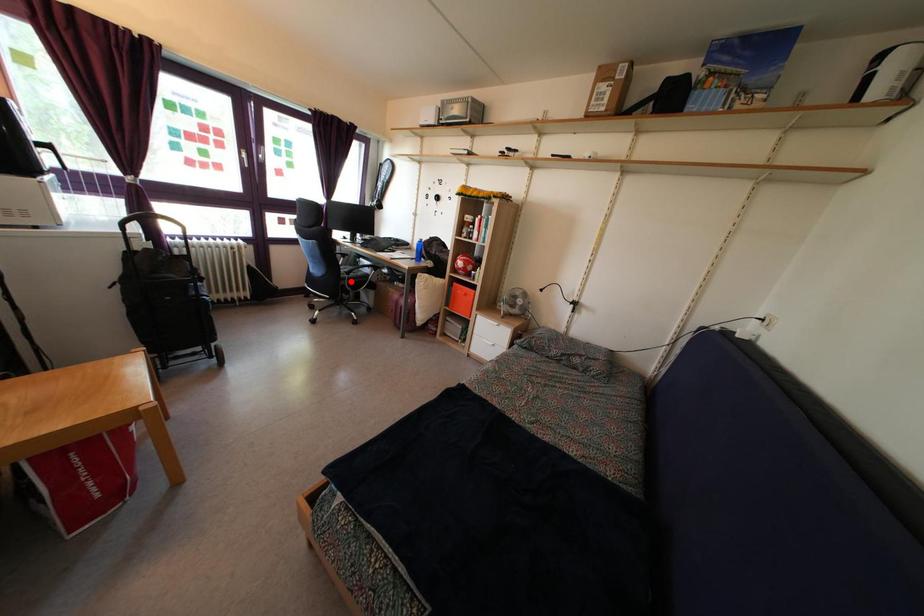
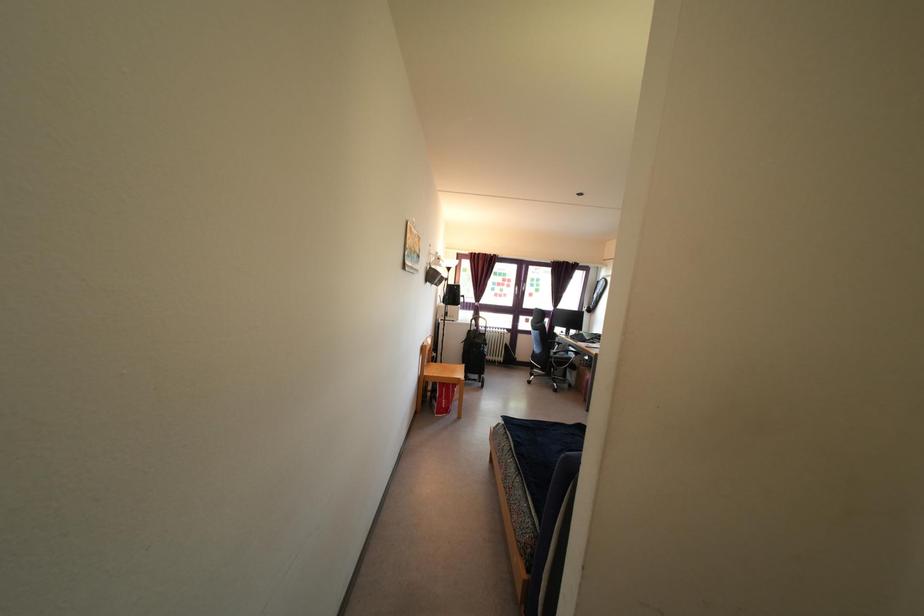
Question: I am providing you with two images of the same scene from different viewpoints. Given a red point in image1, look at the same physical point in image2. Is it:

Choices:
 (A) Closer to the viewpoint
 (B) Farther from the viewpoint

Answer: (B)